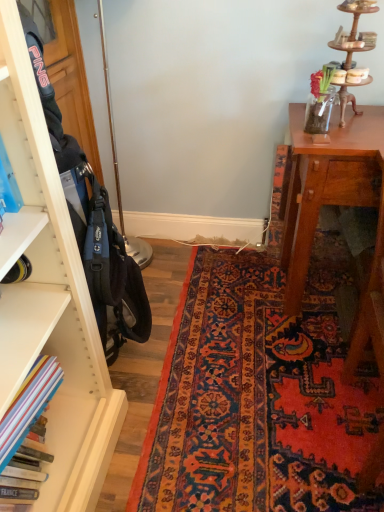
Question: In terms of height, does carpet with intricate patterns at center look taller or shorter compared to hardcover books at left?

Choices:
 (A) short
 (B) tall

Answer: (A)

Question: Is point (329, 352) positioned closer to the camera than point (39, 360)?

Choices:
 (A) closer
 (B) farther

Answer: (B)

Question: In terms of width, does carpet with intricate patterns at center look wider or thinner when compared to hardcover books at left?

Choices:
 (A) wide
 (B) thin

Answer: (A)

Question: In terms of width, does hardcover books at left look wider or thinner when compared to carpet with intricate patterns at center?

Choices:
 (A) thin
 (B) wide

Answer: (A)

Question: Is hardcover books at left inside the boundaries of carpet with intricate patterns at center, or outside?

Choices:
 (A) inside
 (B) outside

Answer: (B)

Question: Is point (1, 426) positioned closer to the camera than point (269, 408)?

Choices:
 (A) farther
 (B) closer

Answer: (B)

Question: From the image's perspective, is hardcover books at left positioned above or below carpet with intricate patterns at center?

Choices:
 (A) below
 (B) above

Answer: (A)